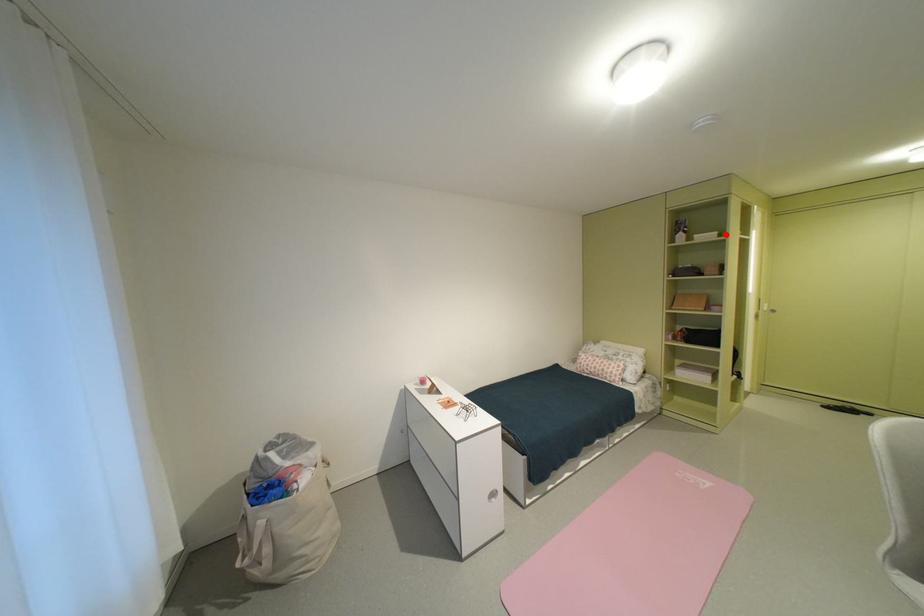
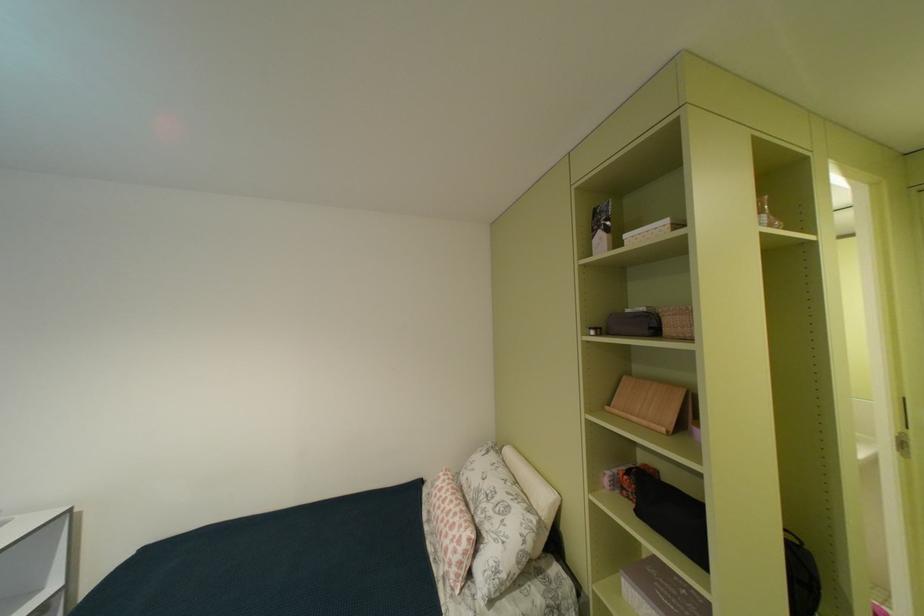
Find the pixel in the second image that matches the highlighted location in the first image.

(676, 223)